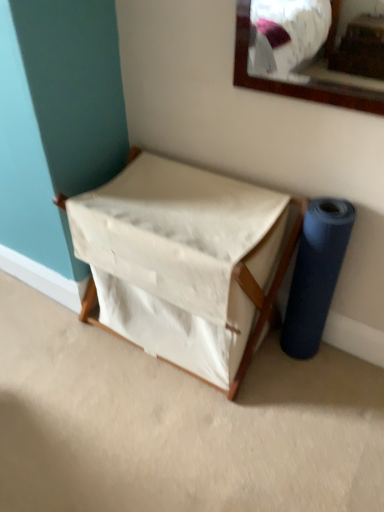
Question: Considering their positions, is blue rubber roll at right located in front of or behind white canvas laundry basket at center?

Choices:
 (A) behind
 (B) front

Answer: (A)

Question: Which is correct: blue rubber roll at right is inside white canvas laundry basket at center, or outside of it?

Choices:
 (A) outside
 (B) inside

Answer: (A)

Question: Is blue rubber roll at right taller or shorter than white canvas laundry basket at center?

Choices:
 (A) tall
 (B) short

Answer: (A)

Question: Based on their sizes in the image, would you say white canvas laundry basket at center is bigger or smaller than blue rubber roll at right?

Choices:
 (A) big
 (B) small

Answer: (A)

Question: In the image, is white canvas laundry basket at center on the left side or the right side of blue rubber roll at right?

Choices:
 (A) right
 (B) left

Answer: (B)

Question: Is point (256, 236) closer or farther from the camera than point (314, 264)?

Choices:
 (A) farther
 (B) closer

Answer: (B)

Question: In the image, is white canvas laundry basket at center positioned in front of or behind blue rubber roll at right?

Choices:
 (A) behind
 (B) front

Answer: (B)